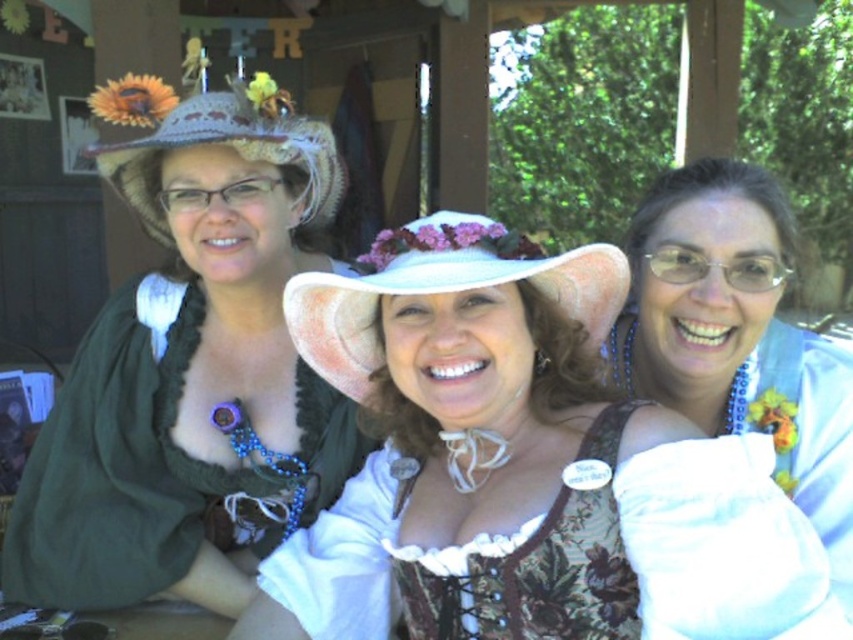
You are a photographer at the event and need to frame a shot that includes both the white satin dress at center and the crochethat at left. Which of the two should you focus on first if you want to ensure both are in the frame?

The white satin dress at center is smaller than the crochethat at left, so you should focus on the crochethat at left first to ensure it fits within the frame before adjusting for the smaller white satin dress at center.

You are standing at the entrance of the pavilion and want to locate the white fabric dress at center. Which direction should you look to find it?

The white fabric dress at center is located at point 0.731 on the x axis and 0.614 on the y axis, so you should look towards the upper right direction from your current position at the entrance.

Looking at the three women in the image, which object is positioned to the right of the other between the white fabric dress at center and the white fabric hat at center?

The white fabric dress at center is positioned to the right of the white fabric hat at center.